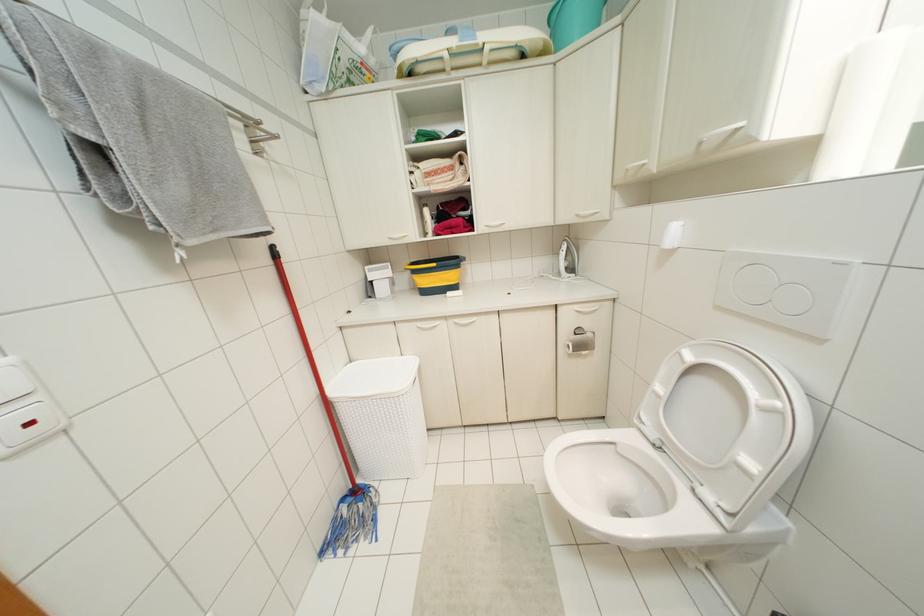
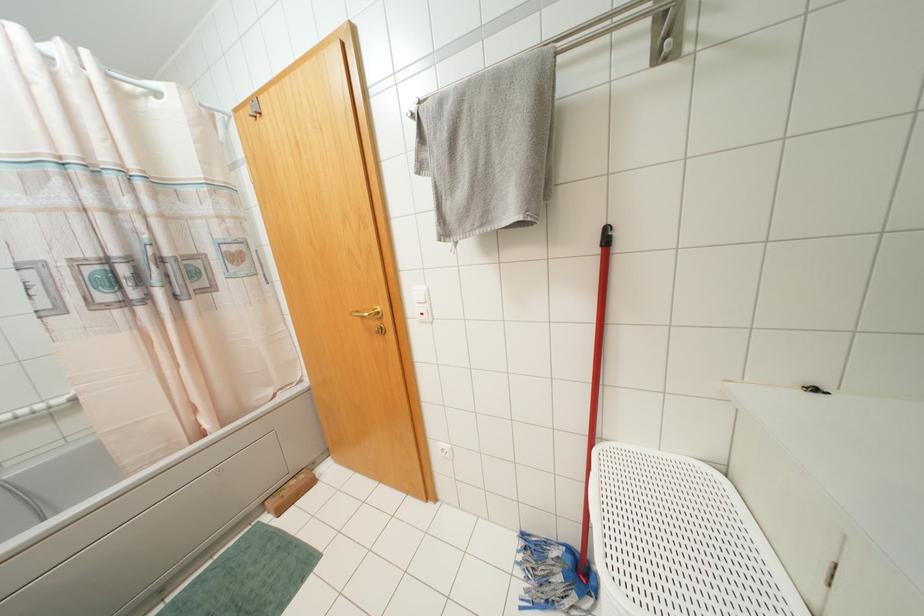
In the second image, find the point that corresponds to the point at 273,246 in the first image.

(606, 229)